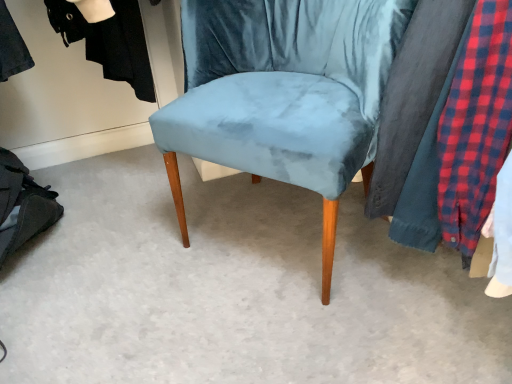
Question: Should I look upward or downward to see velvet blue chair at center?

Choices:
 (A) up
 (B) down

Answer: (A)